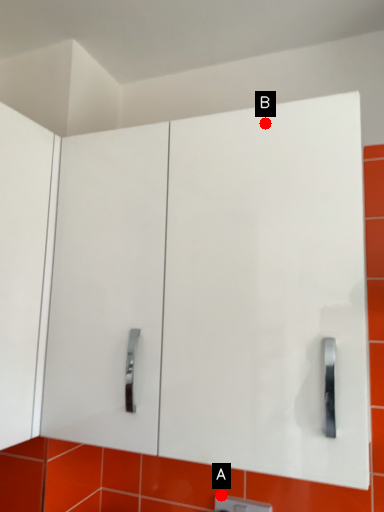
Question: Two points are circled on the image, labeled by A and B beside each circle. Which point is farther from the camera taking this photo?

Choices:
 (A) A is further
 (B) B is further

Answer: (A)